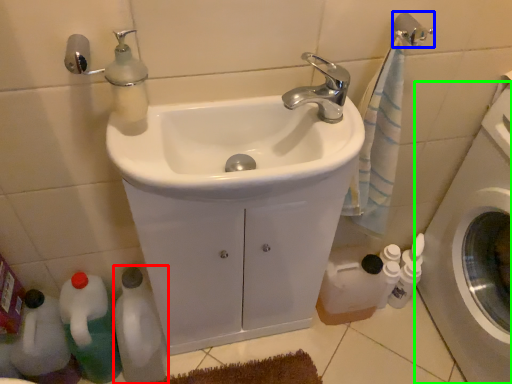
Question: Estimate the real-world distances between objects in this image. Which object is farther from bottle (highlighted by a red box), towel bar (highlighted by a blue box) or washing machine (highlighted by a green box)?

Choices:
 (A) towel bar
 (B) washing machine

Answer: (A)